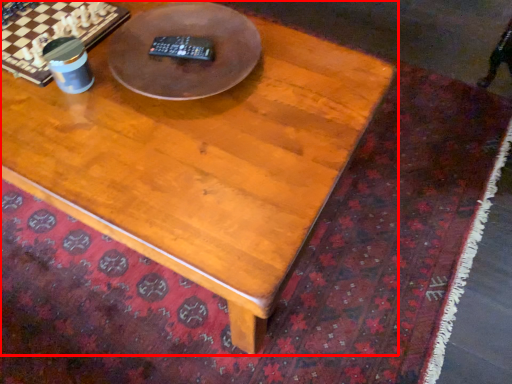
Question: From the image's perspective, what is the correct spatial positioning of coffee table (annotated by the red box) in reference to round table?

Choices:
 (A) above
 (B) below

Answer: (B)